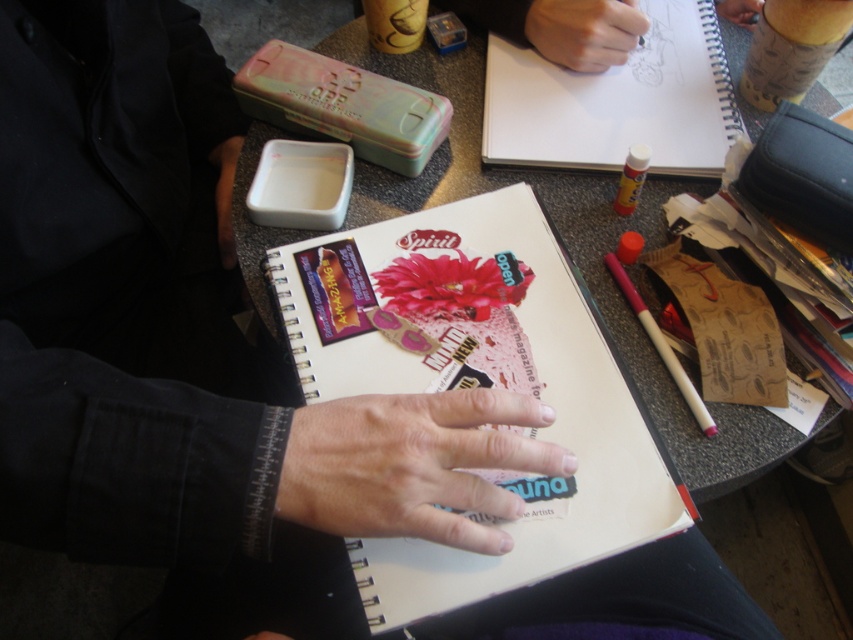
Is spiral-bound paper at upper center above matte skin hand at upper center?

Incorrect, spiral-bound paper at upper center is not positioned above matte skin hand at upper center.

At what (x,y) coordinates should I click in order to perform the action: click on spiral-bound paper at upper center. Please return your answer as a coordinate pair (x, y). Looking at the image, I should click on (618, 100).

Which is behind, point (636, 38) or point (653, 340)?

The point (636, 38) is behind.

Does point (619, 56) lie in front of point (637, 310)?

No, it is behind (637, 310).

At what (x,y) coordinates should I click in order to perform the action: click on matte skin hand at upper center. Please return your answer as a coordinate pair (x, y). Looking at the image, I should click on (584, 32).

Is point (280, 492) less distant than point (703, 74)?

Yes, it is in front of point (703, 74).

Does dry skin at center come behind spiral-bound paper at upper center?

No, it is not.

Is point (291, 451) farther from viewer compared to point (659, 157)?

No, it is in front of (659, 157).

This screenshot has height=640, width=853. Find the location of `dry skin at center`. dry skin at center is located at coordinates (412, 465).